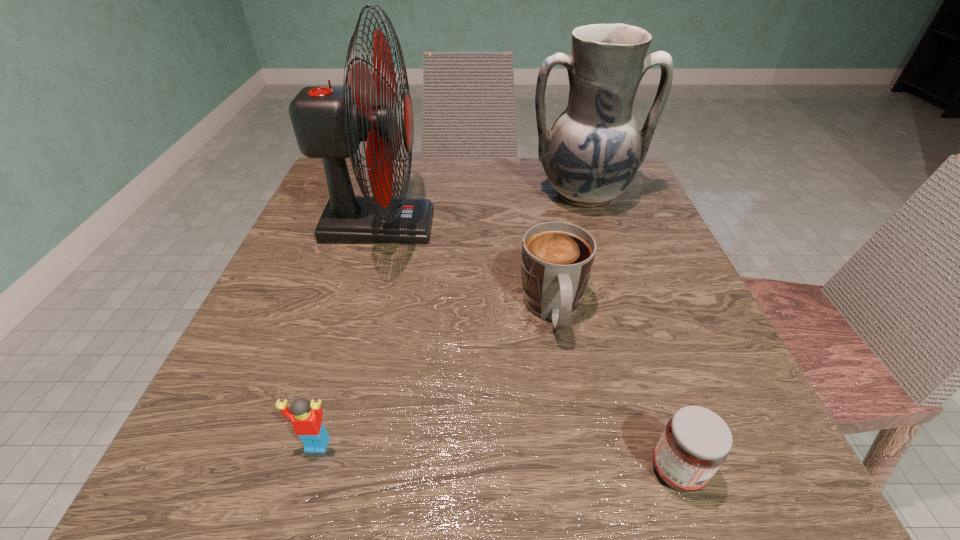
You are a GUI agent. You are given a task and a screenshot of the screen. Output one action in this format:
    pyautogui.click(x=<x>, y=<y>)
    Task: Click on the pitcher situated at the far edge
    Image resolution: width=960 pixels, height=540 pixels.
    Given the screenshot: What is the action you would take?
    pyautogui.click(x=591, y=155)

The width and height of the screenshot is (960, 540). Identify the location of Lego that is at the near edge. (306, 418).

This screenshot has height=540, width=960. What are the coordinates of `jam that is at the near edge` in the screenshot? It's located at (696, 441).

The width and height of the screenshot is (960, 540). I want to click on fan that is at the left edge, so click(x=329, y=122).

Image resolution: width=960 pixels, height=540 pixels. I want to click on Lego located in the left edge section of the desktop, so click(306, 418).

Where is `pitcher that is at the right edge`? This screenshot has height=540, width=960. pitcher that is at the right edge is located at coordinates (591, 155).

Find the location of `jam positioned at the right edge`. jam positioned at the right edge is located at coordinates (696, 441).

Find the location of a particular element. The width and height of the screenshot is (960, 540). object positioned at the far left corner is located at coordinates (329, 122).

The height and width of the screenshot is (540, 960). Find the location of `object that is at the near left corner`. object that is at the near left corner is located at coordinates (306, 418).

I want to click on object positioned at the far right corner, so click(x=591, y=155).